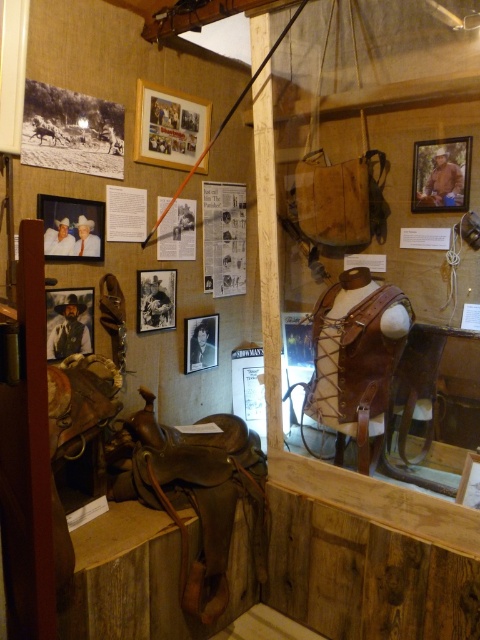
You are standing in the museum and want to take a closer look at the matte wooden picture frame at upper left. If you walk forward 5 feet, will you be able to touch it?

The matte wooden picture frame at upper left is 6.30 feet away from the camera. After walking forward 5 feet, you will still be 1.30 feet away from it, so you cannot touch it yet.

You are an interior designer planning to hang two frames in a gallery wall. You have a wooden frame at upper center and a black matte photo frame at center. Which one has a greater width?

The wooden frame at upper center has a greater width than the black matte photo frame at center.